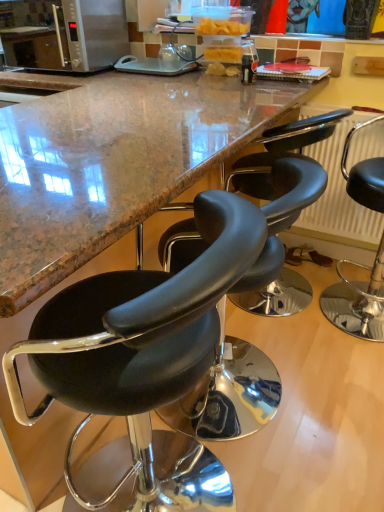
Question: From the image's perspective, is black leather stool at right, which is counted as the first chair, starting from the right, located beneath black leather stool at center, which is the first chair from left to right?

Choices:
 (A) yes
 (B) no

Answer: (B)

Question: Is black leather stool at right, which is counted as the 3th chair, starting from the left, oriented towards black leather stool at center, which is the first chair from left to right?

Choices:
 (A) no
 (B) yes

Answer: (A)

Question: From a real-world perspective, is black leather stool at right, which is counted as the 3th chair, starting from the left, physically above black leather stool at center, marked as the 3th chair in a right-to-left arrangement?

Choices:
 (A) no
 (B) yes

Answer: (A)

Question: Does black leather stool at right, which is counted as the first chair, starting from the right, have a smaller size compared to black leather stool at center, which is the first chair from left to right?

Choices:
 (A) yes
 (B) no

Answer: (A)

Question: Can you confirm if black leather stool at right, which is counted as the first chair, starting from the right, is shorter than black leather stool at center, marked as the 3th chair in a right-to-left arrangement?

Choices:
 (A) no
 (B) yes

Answer: (B)

Question: Which is correct: satin silver microwave at upper left is inside black leather stool at center, which is the first chair from left to right, or outside of it?

Choices:
 (A) outside
 (B) inside

Answer: (A)

Question: From their relative heights in the image, would you say satin silver microwave at upper left is taller or shorter than black leather stool at center, which is the first chair from left to right?

Choices:
 (A) short
 (B) tall

Answer: (A)

Question: From a real-world perspective, relative to black leather stool at center, marked as the 3th chair in a right-to-left arrangement, is satin silver microwave at upper left vertically above or below?

Choices:
 (A) below
 (B) above

Answer: (B)

Question: From the image's perspective, relative to black leather stool at center, which is the first chair from left to right, is satin silver microwave at upper left above or below?

Choices:
 (A) above
 (B) below

Answer: (A)

Question: Do you think black leather stool at center, the second chair from the left, is within black leather stool at center, marked as the 3th chair in a right-to-left arrangement, or outside of it?

Choices:
 (A) outside
 (B) inside

Answer: (A)

Question: Is point (279, 216) positioned closer to the camera than point (122, 348)?

Choices:
 (A) closer
 (B) farther

Answer: (B)

Question: From the image's perspective, is black leather stool at center, marked as the 2th chair in a right-to-left arrangement, above or below black leather stool at center, which is the first chair from left to right?

Choices:
 (A) above
 (B) below

Answer: (A)

Question: Is black leather stool at center, the second chair from the left, in front of or behind black leather stool at center, which is the first chair from left to right, in the image?

Choices:
 (A) front
 (B) behind

Answer: (B)

Question: From a real-world perspective, is black leather stool at center, marked as the 2th chair in a right-to-left arrangement, physically located above or below metallic radiator at right?

Choices:
 (A) above
 (B) below

Answer: (B)

Question: Considering the relative positions of black leather stool at center, marked as the 2th chair in a right-to-left arrangement, and metallic radiator at right in the image provided, is black leather stool at center, marked as the 2th chair in a right-to-left arrangement, to the left or to the right of metallic radiator at right?

Choices:
 (A) right
 (B) left

Answer: (B)